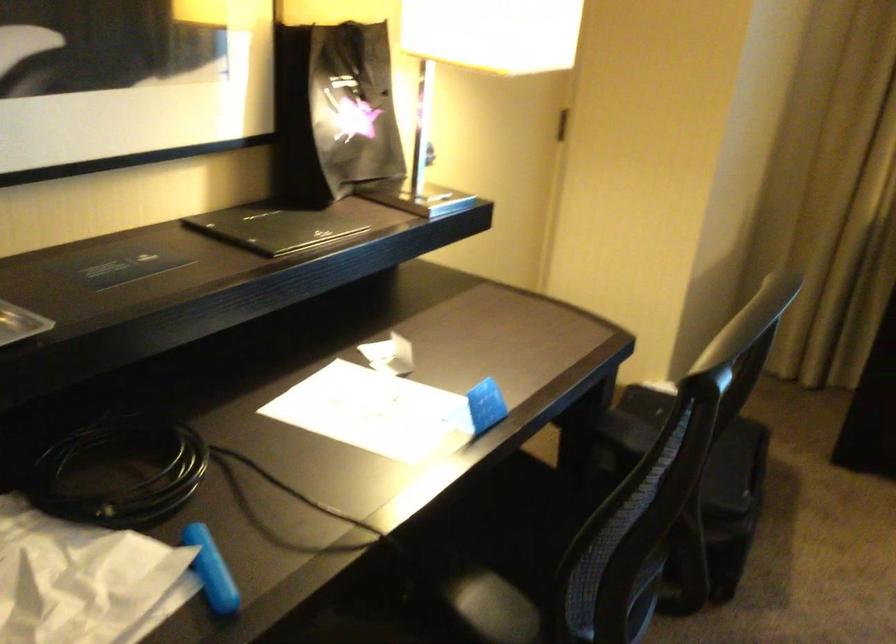
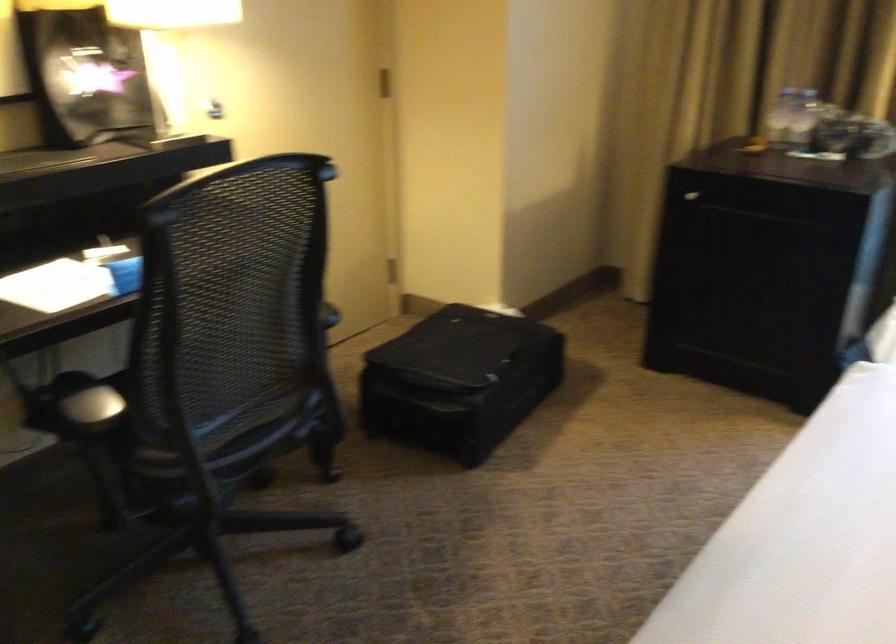
Question: The images are taken continuously from a first-person perspective. In which direction is your viewpoint rotating?

Choices:
 (A) Left
 (B) Right
 (C) Up
 (D) Down

Answer: (A)